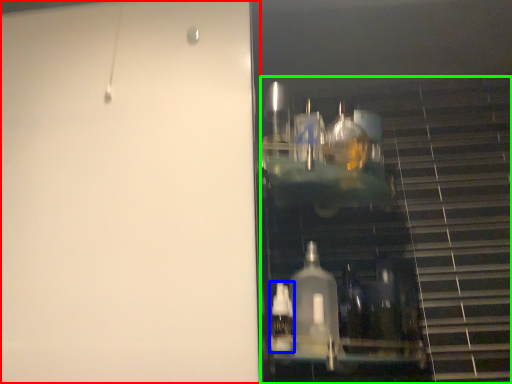
Question: Based on their relative distances, which object is nearer to door (highlighted by a red box)? Choose from bottle (highlighted by a blue box) and stairwell (highlighted by a green box).

Choices:
 (A) bottle
 (B) stairwell

Answer: (B)